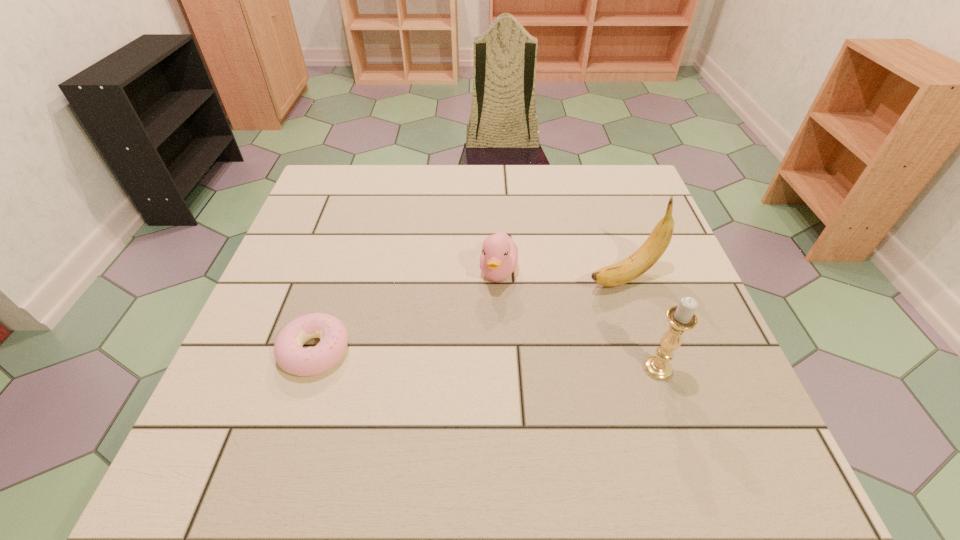
Identify the location of free spot at the right edge of the desktop. (648, 315).

Where is `free space at the far right corner of the desktop`? This screenshot has width=960, height=540. free space at the far right corner of the desktop is located at coordinates (597, 184).

Find the location of a particular element. This screenshot has height=540, width=960. vacant region between the doughnut and the banana is located at coordinates (469, 313).

Locate an element on the screen. The image size is (960, 540). free area in between the candle holder and the banana is located at coordinates (641, 322).

The height and width of the screenshot is (540, 960). What are the coordinates of `free space between the shortest object and the third tallest object` in the screenshot? It's located at click(x=407, y=311).

Where is `vacant point located between the duckling and the leftmost object`? vacant point located between the duckling and the leftmost object is located at coordinates (407, 311).

Find the location of a particular element. This screenshot has height=540, width=960. free area in between the candle holder and the banana is located at coordinates (641, 322).

The width and height of the screenshot is (960, 540). I want to click on free area in between the shortest object and the banana, so click(x=469, y=313).

Where is `free spot between the banana and the second shortest object`? The image size is (960, 540). free spot between the banana and the second shortest object is located at coordinates (562, 274).

This screenshot has height=540, width=960. In order to click on vacant space that's between the candle holder and the second object from left to right in this screenshot , I will do `click(578, 320)`.